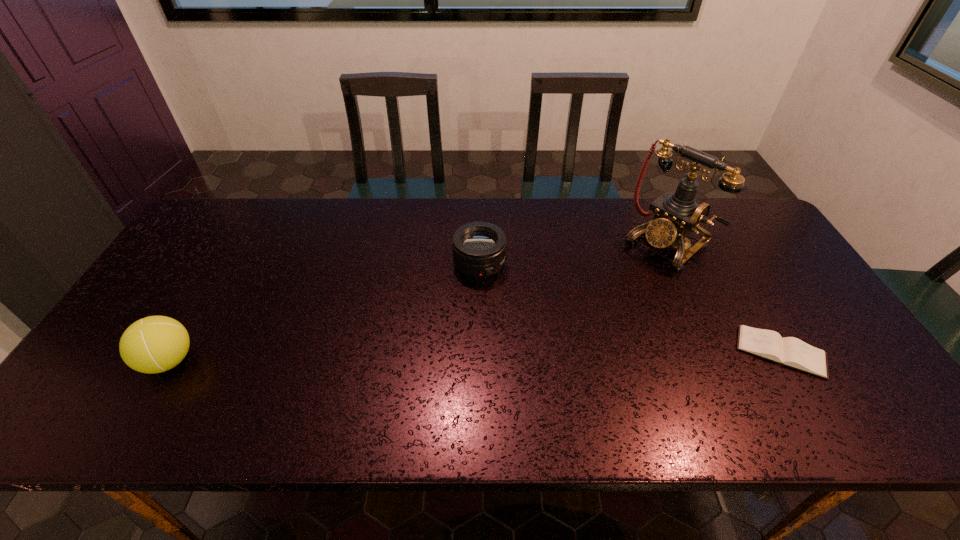
Where is `the third shortest object`? The image size is (960, 540). the third shortest object is located at coordinates (154, 344).

Find the location of a particular element. Image resolution: width=960 pixels, height=540 pixels. the leftmost object is located at coordinates (154, 344).

Identify the location of diary. (789, 351).

In order to click on telephone in this screenshot , I will do `click(677, 214)`.

Locate an element on the screen. The height and width of the screenshot is (540, 960). the second object from left to right is located at coordinates (479, 248).

Find the location of a particular element. This screenshot has height=540, width=960. telephoto lens is located at coordinates (479, 248).

You are a GUI agent. You are given a task and a screenshot of the screen. Output one action in this format:
    pyautogui.click(x=<x>, y=<y>)
    Task: Click on the vacant space situated on the back of the third shortest object
    The width and height of the screenshot is (960, 540).
    Given the screenshot: What is the action you would take?
    pyautogui.click(x=235, y=249)

Identify the location of free space located on the back of the shortest object. (732, 267).

This screenshot has height=540, width=960. In order to click on free space located 0.220m on the front of the tallest object, featuring the rotary dial in this screenshot , I will do `click(597, 300)`.

Find the location of `vacant area situated on the front of the tallest object, featuring the rotary dial`. vacant area situated on the front of the tallest object, featuring the rotary dial is located at coordinates (600, 299).